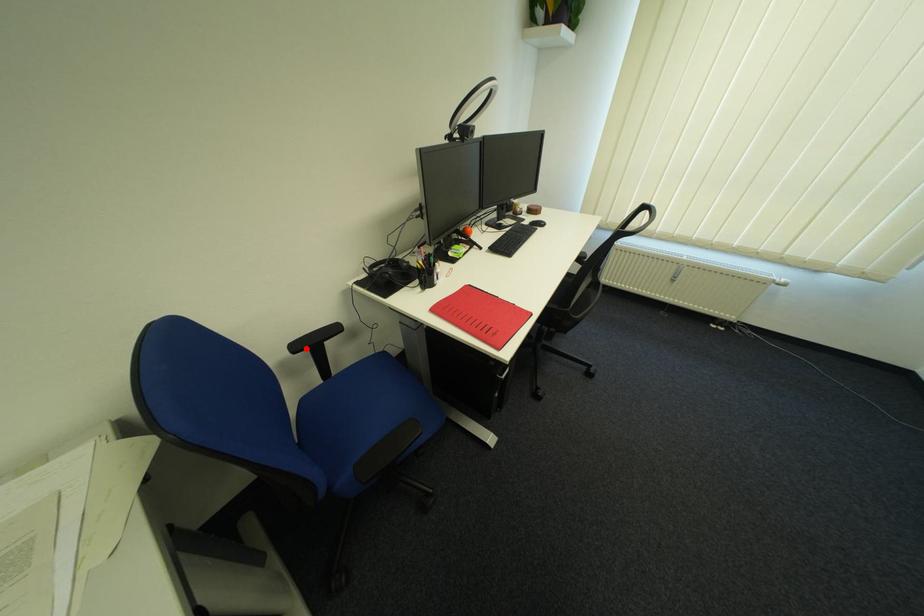
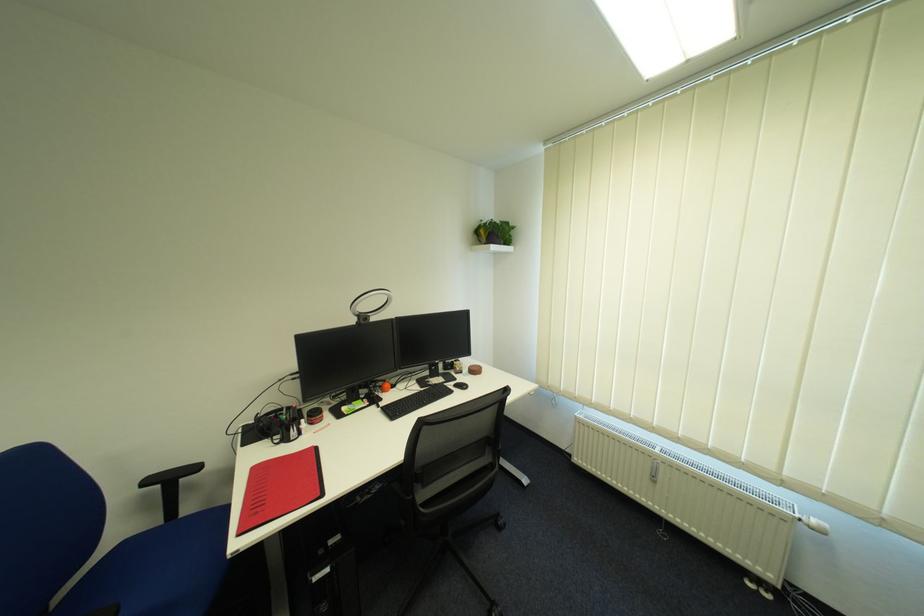
Question: I am providing you with two images of the same scene from different viewpoints. A red point is marked on the first image. At the location where the point appears in image 1, is it still visible in image 2?

Choices:
 (A) Yes
 (B) No

Answer: (A)